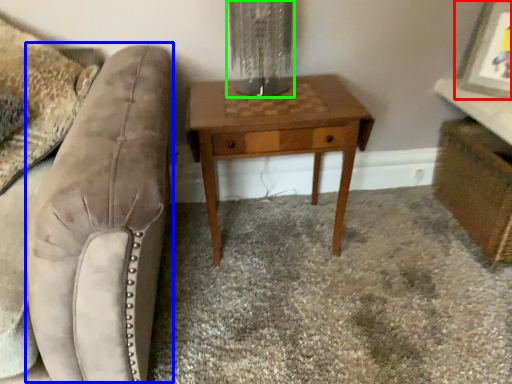
Question: Which is farther away from picture frame (highlighted by a red box)? swivel chair (highlighted by a blue box) or table lamp (highlighted by a green box)?

Choices:
 (A) swivel chair
 (B) table lamp

Answer: (A)